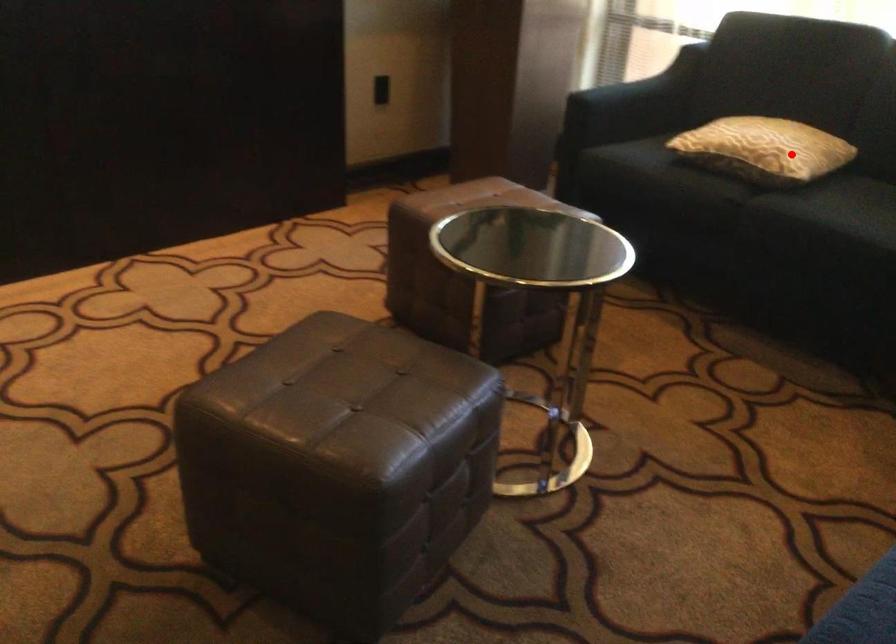
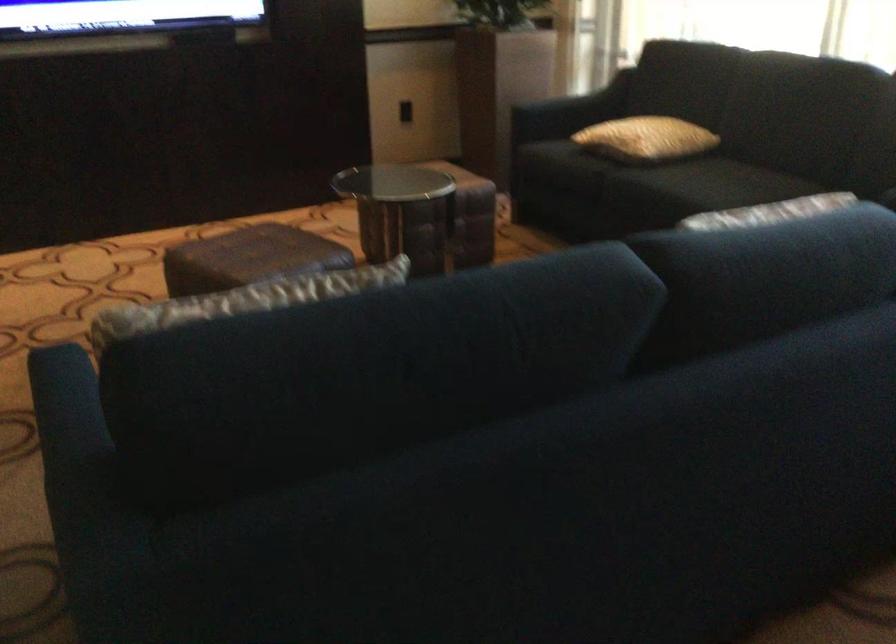
Where in the second image is the point corresponding to the highlighted location from the first image?

(645, 138)